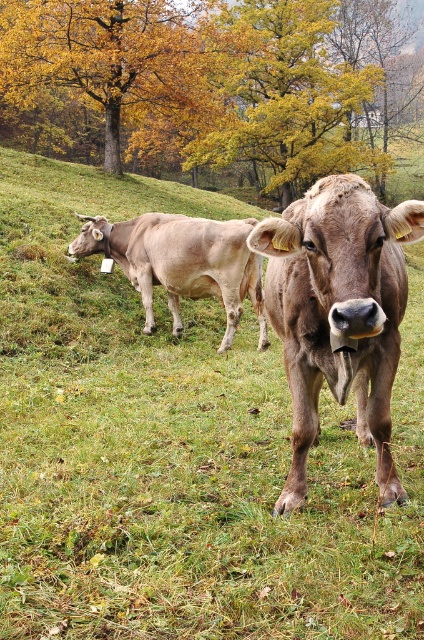
You are standing in the field and want to walk from the yellow leafy tree at upper center to the smooth brown cow at left. Which direction should you face to move towards the cow?

You should face towards the left direction to move from the yellow leafy tree at upper center to the smooth brown cow at left since the cow is positioned to the left side of the tree.

You are standing at the origin point of the coordinate system in this image. The brown matte cow at center is represented by point (339, 312). If you want to walk towards the cow, in which direction should you move?

To reach the brown matte cow at center located at point (339, 312), you should move northeast since the x and y coordinates are both positive from the origin.

You are standing in the field and see the yellow leafy tree at upper center and the smooth brown cow at left. Which object is higher up in the image?

The yellow leafy tree at upper center is positioned over the smooth brown cow at left, so it is higher up in the image.